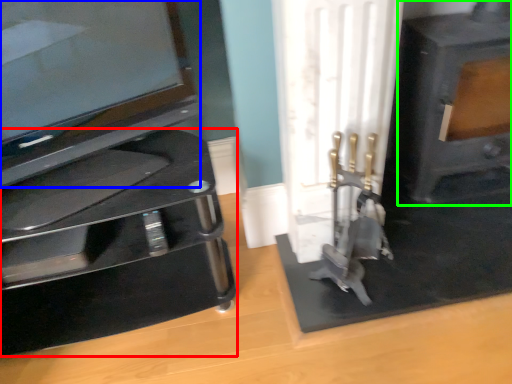
Question: Considering the real-world distances, which object is farthest from furniture (highlighted by a red box)? television (highlighted by a blue box) or fireplace (highlighted by a green box)?

Choices:
 (A) television
 (B) fireplace

Answer: (B)